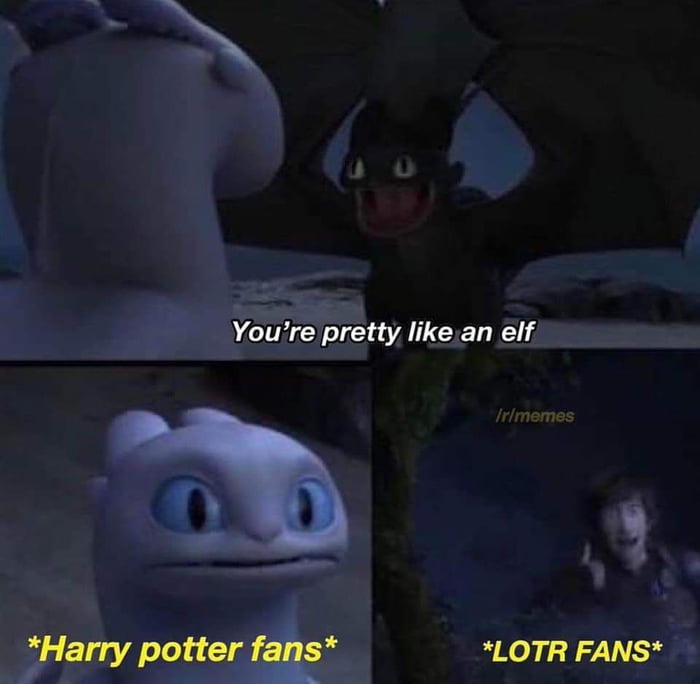
Where is `small box #2`? The width and height of the screenshot is (700, 684). small box #2 is located at coordinates (407, 421).